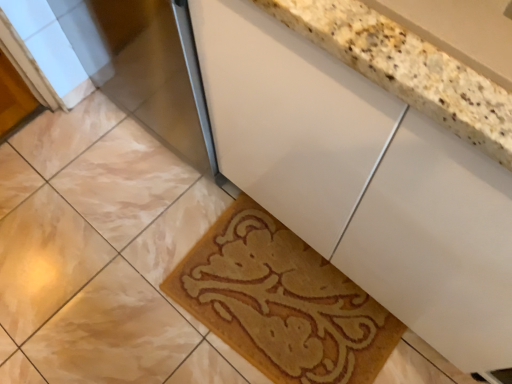
Question: Considering the relative sizes of white glossy cabinet at center and beige textured bath mat at lower center in the image provided, is white glossy cabinet at center taller than beige textured bath mat at lower center?

Choices:
 (A) no
 (B) yes

Answer: (B)

Question: From the image's perspective, is white glossy cabinet at center located above beige textured bath mat at lower center?

Choices:
 (A) no
 (B) yes

Answer: (B)

Question: Is white glossy cabinet at center smaller than beige textured bath mat at lower center?

Choices:
 (A) no
 (B) yes

Answer: (A)

Question: Could you tell me if white glossy cabinet at center is facing beige textured bath mat at lower center?

Choices:
 (A) no
 (B) yes

Answer: (B)

Question: Can you confirm if white glossy cabinet at center is positioned to the right of beige textured bath mat at lower center?

Choices:
 (A) yes
 (B) no

Answer: (A)

Question: Is the depth of white glossy cabinet at center greater than that of beige textured bath mat at lower center?

Choices:
 (A) no
 (B) yes

Answer: (A)

Question: From the image's perspective, does beige textured bath mat at lower center appear lower than marble tile at lower left?

Choices:
 (A) no
 (B) yes

Answer: (B)

Question: Is beige textured bath mat at lower center outside of marble tile at lower left?

Choices:
 (A) yes
 (B) no

Answer: (A)

Question: From a real-world perspective, is beige textured bath mat at lower center on top of marble tile at lower left?

Choices:
 (A) no
 (B) yes

Answer: (B)

Question: Does beige textured bath mat at lower center appear on the right side of marble tile at lower left?

Choices:
 (A) yes
 (B) no

Answer: (A)

Question: Is the surface of beige textured bath mat at lower center in direct contact with marble tile at lower left?

Choices:
 (A) no
 (B) yes

Answer: (A)

Question: Could you tell me if beige textured bath mat at lower center is facing marble tile at lower left?

Choices:
 (A) yes
 (B) no

Answer: (B)

Question: Considering the relative sizes of marble tile at lower left and white glossy cabinet at center in the image provided, is marble tile at lower left smaller than white glossy cabinet at center?

Choices:
 (A) no
 (B) yes

Answer: (B)